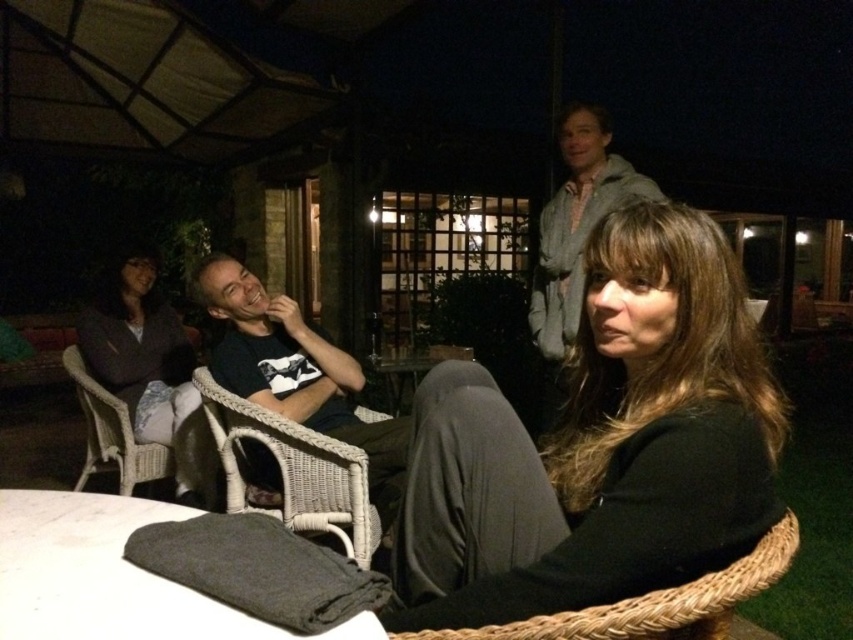
Does black matte jacket at center appear on the right side of dark gray fabric jacket at left?

Correct, you'll find black matte jacket at center to the right of dark gray fabric jacket at left.

Is point (689, 467) behind point (146, 308)?

No, it is in front of (146, 308).

Image resolution: width=853 pixels, height=640 pixels. Identify the location of black matte jacket at center. (601, 444).

Does white wicker chair at center appear on the right side of wicker chair at left?

Indeed, white wicker chair at center is positioned on the right side of wicker chair at left.

Can you confirm if white wicker chair at center is positioned above wicker chair at left?

Yes.

Does point (296, 522) come farther from viewer compared to point (138, 452)?

That is False.

Find the location of a particular element. The height and width of the screenshot is (640, 853). white wicker chair at center is located at coordinates (294, 470).

Which is below, dark blue t-shirt at center or wicker chair at left?

wicker chair at left

Consider the image. Who is positioned more to the right, dark blue t-shirt at center or wicker chair at left?

From the viewer's perspective, dark blue t-shirt at center appears more on the right side.

Image resolution: width=853 pixels, height=640 pixels. Describe the element at coordinates (296, 372) in the screenshot. I see `dark blue t-shirt at center` at that location.

This screenshot has width=853, height=640. In order to click on dark blue t-shirt at center in this screenshot , I will do `click(296, 372)`.